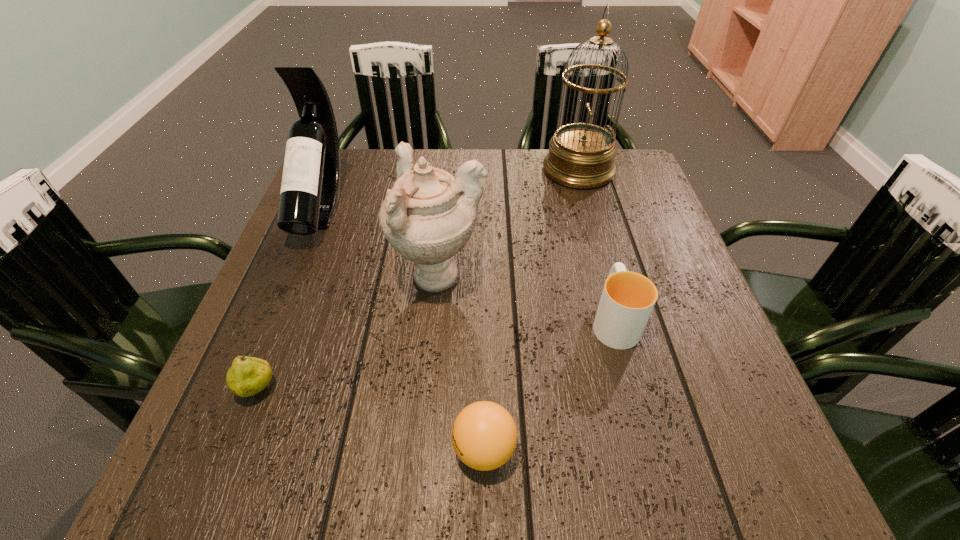
Where is `object present at the near edge`? This screenshot has width=960, height=540. object present at the near edge is located at coordinates (484, 435).

Identify the location of wine bottle located in the left edge section of the desktop. (310, 187).

Find the location of a particular element. This screenshot has width=960, height=540. pear that is at the left edge is located at coordinates (247, 376).

Locate an element on the screen. This screenshot has height=540, width=960. birdcage located in the right edge section of the desktop is located at coordinates (581, 155).

Identify the location of cup at the right edge. Image resolution: width=960 pixels, height=540 pixels. (627, 300).

Where is `object that is at the far left corner`? Image resolution: width=960 pixels, height=540 pixels. object that is at the far left corner is located at coordinates (310, 187).

The image size is (960, 540). Find the location of `object located at the far right corner`. object located at the far right corner is located at coordinates (581, 155).

The image size is (960, 540). In the image, there is a desktop. What are the coordinates of `free region at the far edge` in the screenshot? It's located at (517, 156).

Locate an element on the screen. The height and width of the screenshot is (540, 960). free location at the near edge of the desktop is located at coordinates (430, 437).

In the image, there is a desktop. Identify the location of free region at the left edge. The width and height of the screenshot is (960, 540). (335, 219).